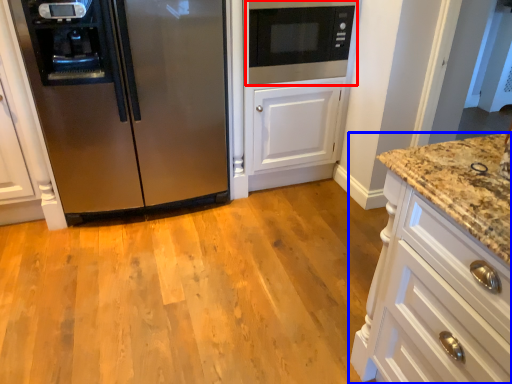
Question: Which of the following is the closest to the observer, microwave oven (highlighted by a red box) or cabinetry (highlighted by a blue box)?

Choices:
 (A) microwave oven
 (B) cabinetry

Answer: (B)